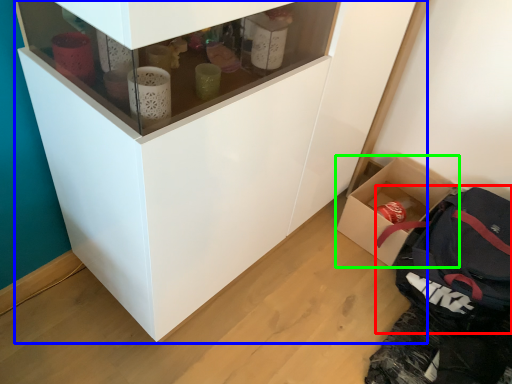
Question: Based on their relative distances, which object is farther from backpack (highlighted by a red box)? Choose from cupboard (highlighted by a blue box) and box (highlighted by a green box).

Choices:
 (A) cupboard
 (B) box

Answer: (A)